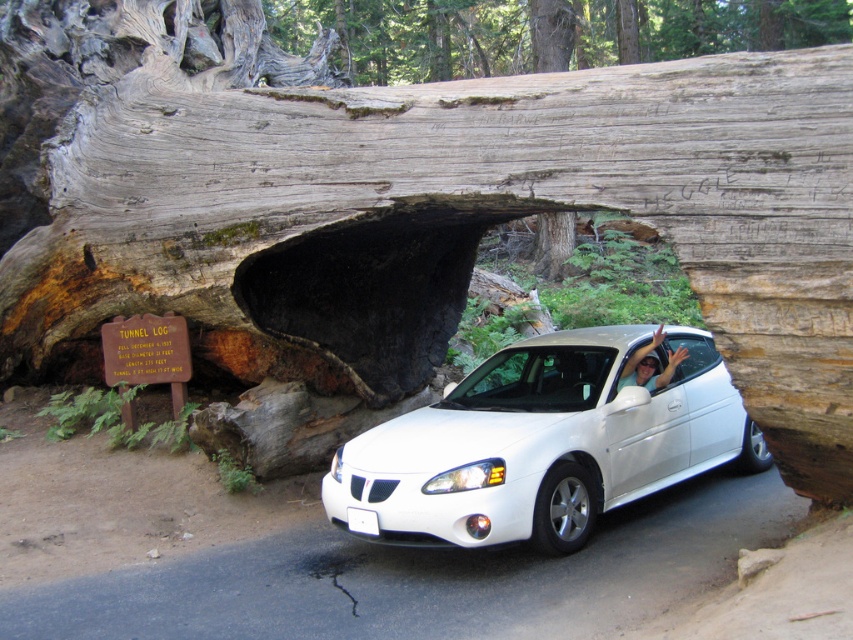
You are standing outside the tunnel formed by the fallen tree trunk and see both the white glossy hatchback at center and the white glossy car at center. Which vehicle is closer to you?

The white glossy hatchback at center is closer to you than the white glossy car at center.

You are a delivery robot that needs to pass through the tunnel formed by the fallen tree trunk. The robot is 30 inches wide. The tunnel entrance is narrow. There are two vehicles in the image, a white glossy hatchback at center and a white glossy car at center. Which vehicle is closer to the tunnel entrance, and will the robot fit through the remaining space?

The white glossy hatchback at center and white glossy car at center are 31.48 inches apart. Since the robot is 30 inches wide, it can fit through the space between them as there is 1.48 inches of clearance. However, the question asks which vehicle is closer to the tunnel entrance. The description does not specify which vehicle is closer, so we cannot determine that from the given information.

You are standing in front of the tunnel formed by the fallen tree trunk and want to take a photo. There are two points marked in the scene, point A at coordinates point (392, 476) and point B at coordinates point (660, 340). Which point will appear larger in your photo?

Point A at coordinates point (392, 476) will appear larger in the photo because it is closer to the camera than point B at coordinates point (660, 340).